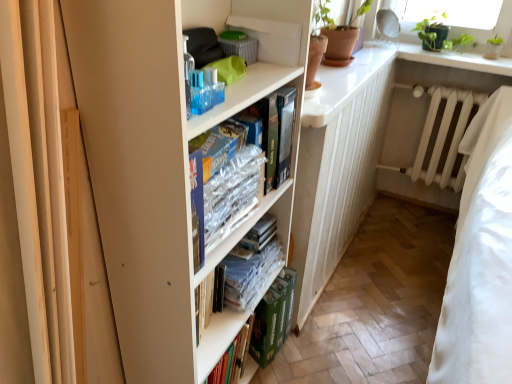
Question: Is point (320, 112) positioned closer to the camera than point (141, 301)?

Choices:
 (A) farther
 (B) closer

Answer: (A)

Question: Would you say white glossy counter top at upper right is to the left or to the right of white matte bookcase at center in the picture?

Choices:
 (A) right
 (B) left

Answer: (A)

Question: Based on their relative distances, which object is farther from the clear plastic books at center, which ranks as the first book in bottom-to-top order?

Choices:
 (A) green cardboard book at lower center
 (B) white glossy counter top at upper right
 (C) hardcover book at center, the 2th book from the bottom
 (D) white smooth window sill at upper right
 (E) white matte radiator at center

Answer: (E)

Question: Which is nearer to the transparent plastic bottle at upper center?

Choices:
 (A) white matte bookcase at center
 (B) white matte radiator at center
 (C) white smooth window sill at upper right
 (D) white glossy counter top at upper right
 (E) clear plastic books at center, which ranks as the first book in bottom-to-top order

Answer: (A)